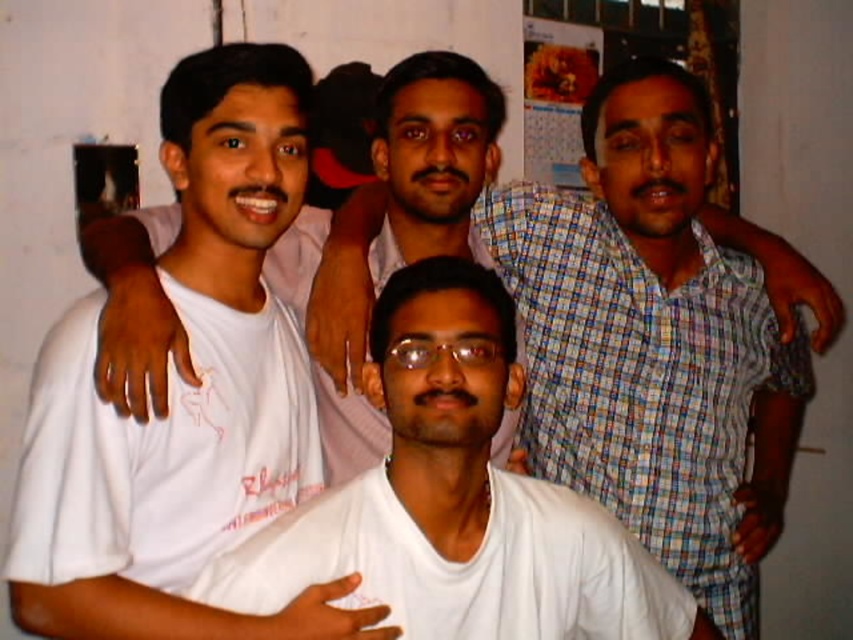
Question: Which object is the closest to the transparent plastic glasses at center?

Choices:
 (A) white matte shirt at center
 (B) white matte t-shirt at left

Answer: (A)

Question: Which object is positioned closest to the white matte t-shirt at left?

Choices:
 (A) white matte shirt at center
 (B) transparent plastic glasses at center

Answer: (A)

Question: Does white matte shirt at center have a lesser width compared to transparent plastic glasses at center?

Choices:
 (A) yes
 (B) no

Answer: (B)

Question: Is white matte t-shirt at left positioned at the back of white matte shirt at center?

Choices:
 (A) no
 (B) yes

Answer: (A)

Question: Which object is farther from the camera taking this photo?

Choices:
 (A) white matte shirt at center
 (B) transparent plastic glasses at center
 (C) white matte t-shirt at left

Answer: (B)

Question: In this image, where is white matte shirt at center located relative to transparent plastic glasses at center?

Choices:
 (A) left
 (B) right

Answer: (B)